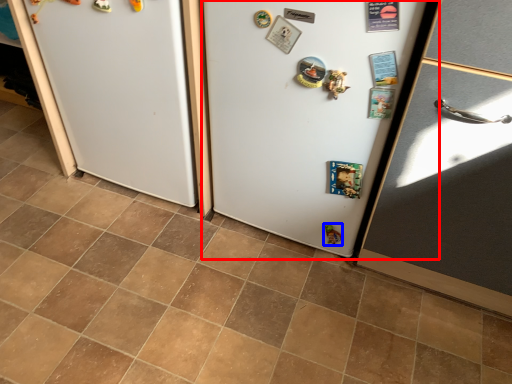
Question: Which object appears farthest to the camera in this image, fridge (highlighted by a red box) or toy (highlighted by a blue box)?

Choices:
 (A) fridge
 (B) toy

Answer: (B)